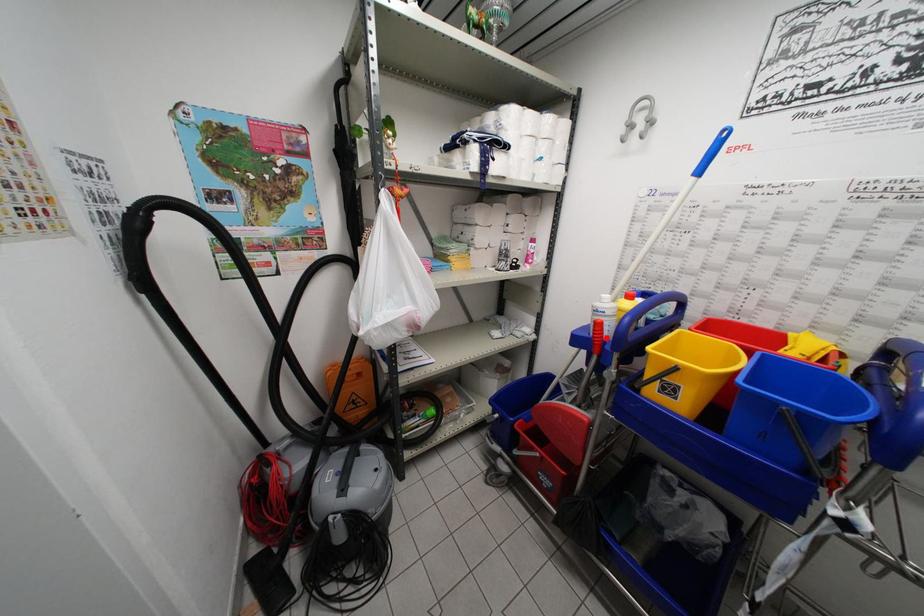
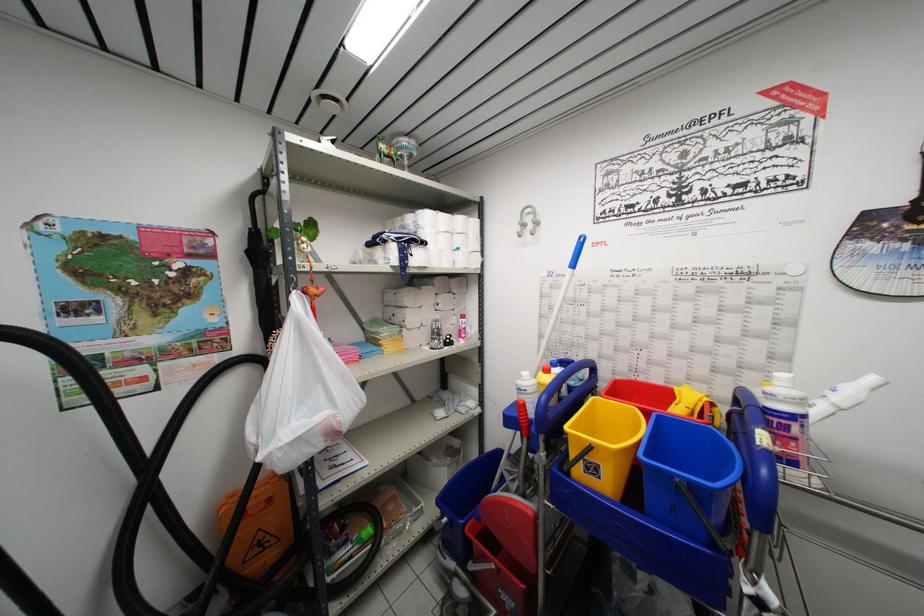
The point at the highlighted location is marked in the first image. Where is the corresponding point in the second image?

(530, 419)